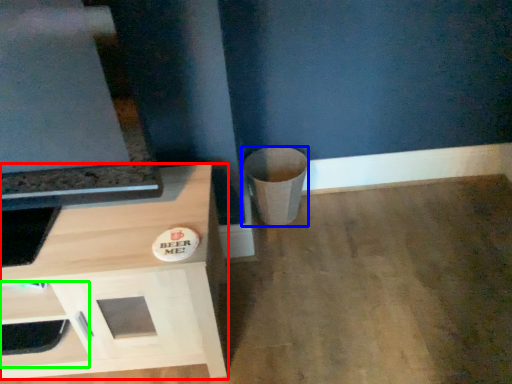
Question: Which is nearer to the cabinetry (highlighted by a red box)? trash bin/can (highlighted by a blue box) or drawer (highlighted by a green box).

Choices:
 (A) trash bin/can
 (B) drawer

Answer: (B)